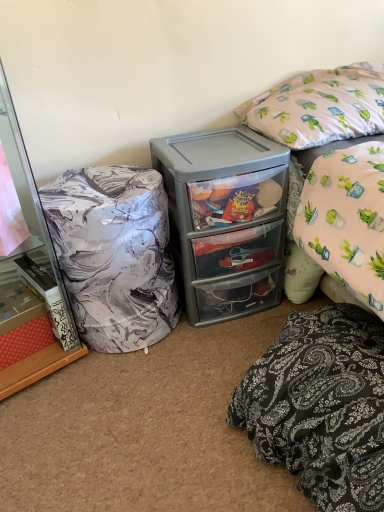
Where is `vacant area that lies between gray plastic storage at center and marble-patterned bean bag at left`? The width and height of the screenshot is (384, 512). vacant area that lies between gray plastic storage at center and marble-patterned bean bag at left is located at coordinates (177, 345).